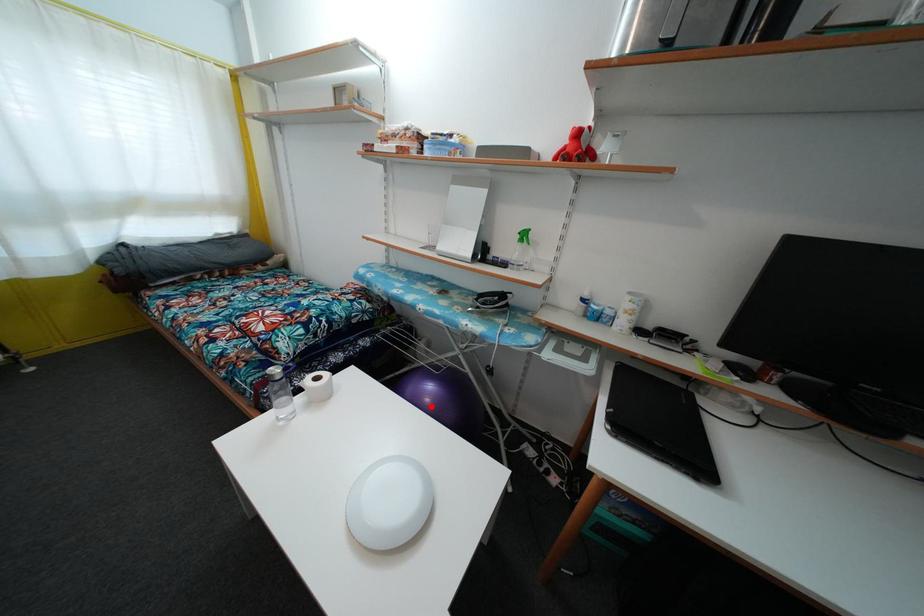
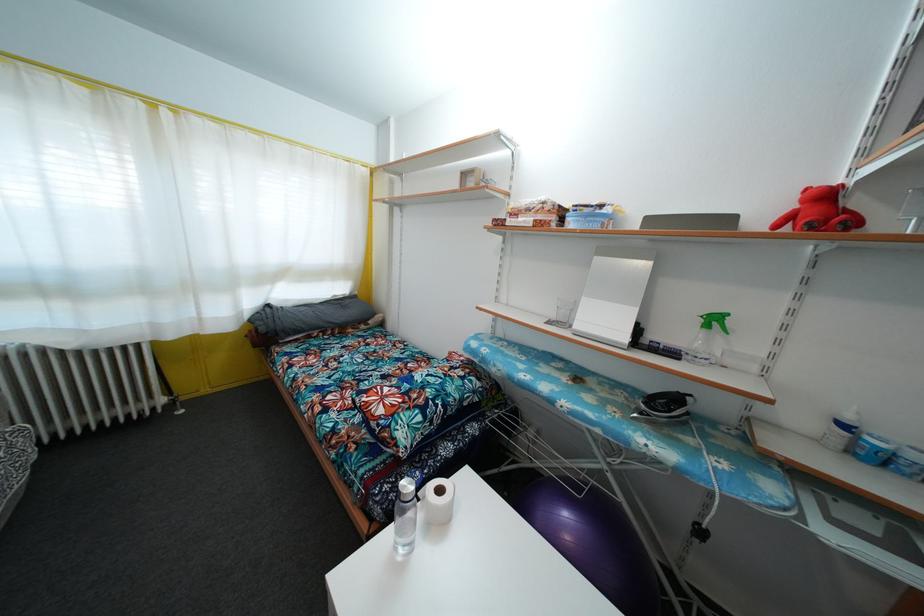
Where in the second image is the point corresponding to the highlighted location from the first image?

(572, 545)